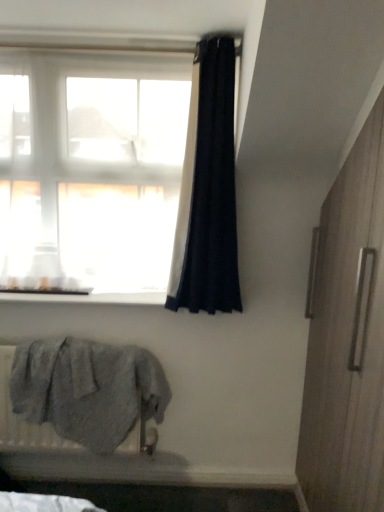
Question: Does white smooth window sill at lower left appear on the left side of black fabric curtain at upper center?

Choices:
 (A) no
 (B) yes

Answer: (B)

Question: Is white smooth window sill at lower left with black fabric curtain at upper center?

Choices:
 (A) no
 (B) yes

Answer: (A)

Question: Does white smooth window sill at lower left contain black fabric curtain at upper center?

Choices:
 (A) no
 (B) yes

Answer: (A)

Question: From the image's perspective, is white smooth window sill at lower left on top of black fabric curtain at upper center?

Choices:
 (A) yes
 (B) no

Answer: (B)

Question: Can you confirm if white smooth window sill at lower left is thinner than black fabric curtain at upper center?

Choices:
 (A) no
 (B) yes

Answer: (A)

Question: Considering the positions of black fabric curtain at upper center and gray fluffy towel at lower left in the image, is black fabric curtain at upper center wider or thinner than gray fluffy towel at lower left?

Choices:
 (A) wide
 (B) thin

Answer: (A)

Question: Which is correct: black fabric curtain at upper center is inside gray fluffy towel at lower left, or outside of it?

Choices:
 (A) outside
 (B) inside

Answer: (A)

Question: Relative to gray fluffy towel at lower left, is black fabric curtain at upper center in front or behind?

Choices:
 (A) front
 (B) behind

Answer: (A)

Question: Is point (216, 114) positioned closer to the camera than point (130, 437)?

Choices:
 (A) farther
 (B) closer

Answer: (B)

Question: In terms of size, does translucent white curtain at upper left appear bigger or smaller than white smooth window sill at lower left?

Choices:
 (A) big
 (B) small

Answer: (A)

Question: Considering their positions, is translucent white curtain at upper left located in front of or behind white smooth window sill at lower left?

Choices:
 (A) front
 (B) behind

Answer: (A)

Question: Visually, is translucent white curtain at upper left positioned to the left or to the right of white smooth window sill at lower left?

Choices:
 (A) right
 (B) left

Answer: (A)

Question: Looking at their shapes, would you say translucent white curtain at upper left is wider or thinner than white smooth window sill at lower left?

Choices:
 (A) thin
 (B) wide

Answer: (A)

Question: Is gray fluffy towel at lower left situated inside wooden screen door at right or outside?

Choices:
 (A) outside
 (B) inside

Answer: (A)

Question: Based on their positions, is gray fluffy towel at lower left located to the left or right of wooden screen door at right?

Choices:
 (A) right
 (B) left

Answer: (B)